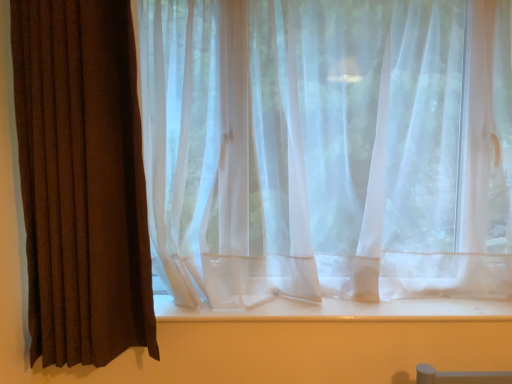
Question: Is brown textured curtain at left, positioned as the 1th curtain in left-to-right order, turned away from translucent white curtain at center, positioned as the 1th curtain in right-to-left order?

Choices:
 (A) yes
 (B) no

Answer: (B)

Question: Is translucent white curtain at center, positioned as the 1th curtain in right-to-left order, surrounded by brown textured curtain at left, placed as the 2th curtain when sorted from right to left?

Choices:
 (A) no
 (B) yes

Answer: (A)

Question: Considering the relative sizes of brown textured curtain at left, placed as the 2th curtain when sorted from right to left, and translucent white curtain at center, positioned as the 1th curtain in right-to-left order, in the image provided, is brown textured curtain at left, placed as the 2th curtain when sorted from right to left, wider than translucent white curtain at center, positioned as the 1th curtain in right-to-left order,?

Choices:
 (A) no
 (B) yes

Answer: (A)

Question: Can you confirm if brown textured curtain at left, placed as the 2th curtain when sorted from right to left, is shorter than translucent white curtain at center, which is the second curtain from left to right?

Choices:
 (A) no
 (B) yes

Answer: (A)

Question: From a real-world perspective, is brown textured curtain at left, placed as the 2th curtain when sorted from right to left, on top of translucent white curtain at center, which is the second curtain from left to right?

Choices:
 (A) yes
 (B) no

Answer: (B)

Question: From the image's perspective, is translucent white curtain at center, which is the second curtain from left to right, located above or below white smooth window sill at center?

Choices:
 (A) below
 (B) above

Answer: (B)

Question: Considering the positions of translucent white curtain at center, positioned as the 1th curtain in right-to-left order, and white smooth window sill at center in the image, is translucent white curtain at center, positioned as the 1th curtain in right-to-left order, taller or shorter than white smooth window sill at center?

Choices:
 (A) short
 (B) tall

Answer: (B)

Question: Would you say translucent white curtain at center, which is the second curtain from left to right, is to the left or to the right of white smooth window sill at center in the picture?

Choices:
 (A) left
 (B) right

Answer: (B)

Question: Considering the positions of point (502, 77) and point (304, 316), is point (502, 77) closer or farther from the camera than point (304, 316)?

Choices:
 (A) closer
 (B) farther

Answer: (B)

Question: In terms of width, does translucent white curtain at center, positioned as the 1th curtain in right-to-left order, look wider or thinner when compared to brown textured curtain at left, placed as the 2th curtain when sorted from right to left?

Choices:
 (A) thin
 (B) wide

Answer: (B)

Question: Is translucent white curtain at center, which is the second curtain from left to right, spatially inside brown textured curtain at left, placed as the 2th curtain when sorted from right to left, or outside of it?

Choices:
 (A) inside
 (B) outside

Answer: (B)

Question: Relative to brown textured curtain at left, positioned as the 1th curtain in left-to-right order, is translucent white curtain at center, positioned as the 1th curtain in right-to-left order, in front or behind?

Choices:
 (A) behind
 (B) front

Answer: (A)

Question: From a real-world perspective, is translucent white curtain at center, which is the second curtain from left to right, positioned above or below brown textured curtain at left, positioned as the 1th curtain in left-to-right order?

Choices:
 (A) below
 (B) above

Answer: (B)

Question: Choose the correct answer: Is brown textured curtain at left, positioned as the 1th curtain in left-to-right order, inside white smooth window sill at center or outside it?

Choices:
 (A) outside
 (B) inside

Answer: (A)

Question: In terms of height, does brown textured curtain at left, placed as the 2th curtain when sorted from right to left, look taller or shorter compared to white smooth window sill at center?

Choices:
 (A) short
 (B) tall

Answer: (B)